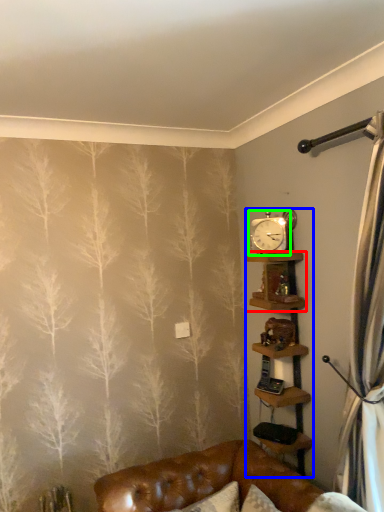
Question: Which object is positioned closest to shelf (highlighted by a red box)? Select from shelf (highlighted by a blue box) and clock (highlighted by a green box).

Choices:
 (A) shelf
 (B) clock

Answer: (B)